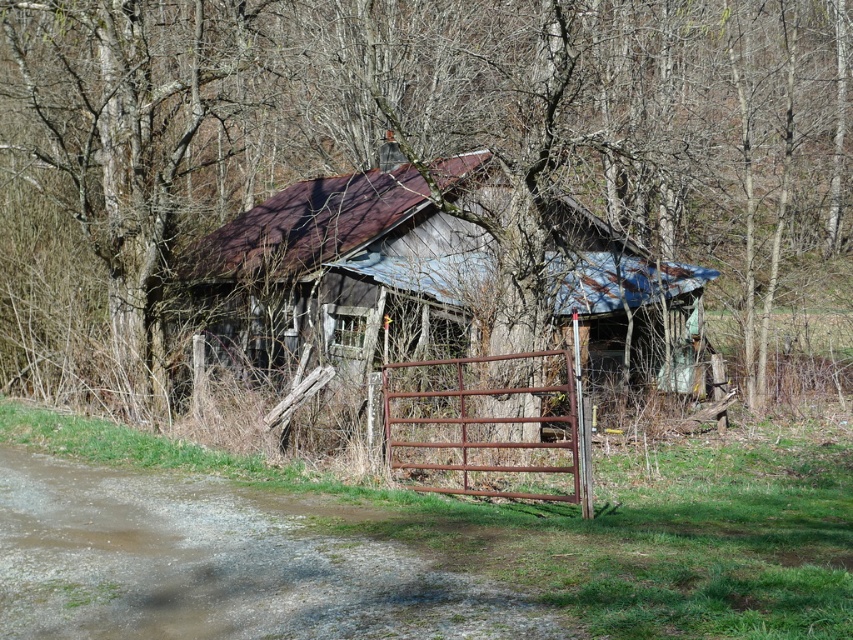
Is rusty metal hut at center shorter than rusty metal gate at center?

No.

Is point (422, 248) closer to viewer compared to point (426, 378)?

That is False.

The height and width of the screenshot is (640, 853). I want to click on rusty metal hut at center, so click(337, 276).

Is brown wood tree at center thinner than rusty metal gate at center?

Incorrect, brown wood tree at center's width is not less than rusty metal gate at center's.

Which is above, brown wood tree at center or rusty metal gate at center?

Positioned higher is brown wood tree at center.

Which is behind, point (155, 291) or point (511, 362)?

The point (155, 291) is more distant.

Locate an element on the screen. The width and height of the screenshot is (853, 640). brown wood tree at center is located at coordinates (445, 125).

Is the position of brown wood tree at center more distant than that of rusty metal hut at center?

Yes, it is.

Measure the distance from brown wood tree at center to rusty metal hut at center.

brown wood tree at center and rusty metal hut at center are 2.47 meters apart.

Who is more forward, (751, 358) or (428, 237)?

Point (428, 237) is in front.

Find the location of `brown wood tree at center`. brown wood tree at center is located at coordinates click(x=445, y=125).